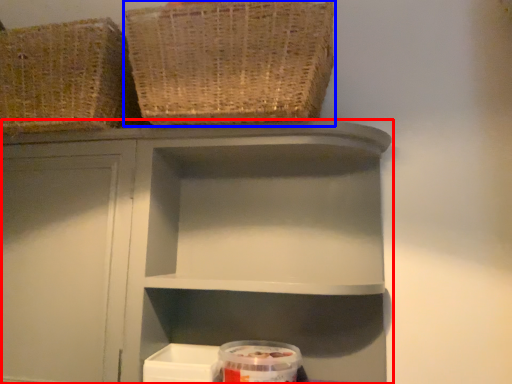
Question: Which object appears closest to the camera in this image, shelf (highlighted by a red box) or basket (highlighted by a blue box)?

Choices:
 (A) shelf
 (B) basket

Answer: (B)